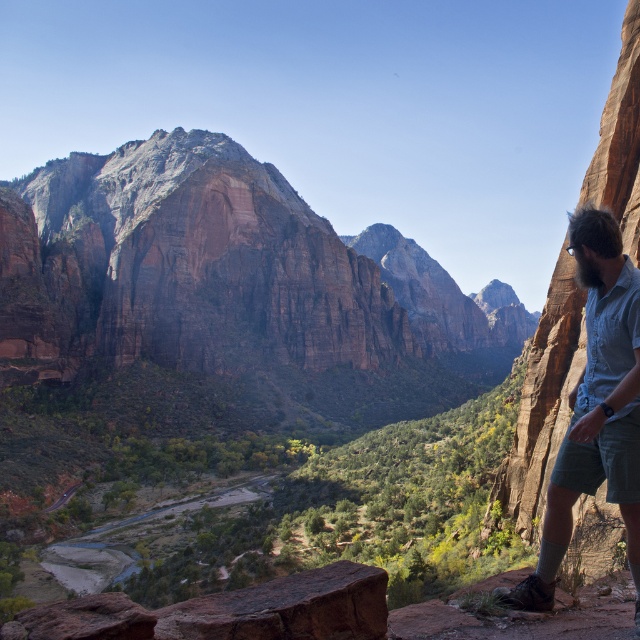
Question: Which is farther from the beige textured shirt at right?

Choices:
 (A) brown rough rock at lower center
 (B) rustic stone mountain at center

Answer: (B)

Question: Observing the image, what is the correct spatial positioning of rustic stone mountain at center in reference to beige textured shirt at right?

Choices:
 (A) below
 (B) above

Answer: (B)

Question: Where is beige textured shirt at right located in relation to brown rough rock at lower center in the image?

Choices:
 (A) above
 (B) below

Answer: (A)

Question: Can you confirm if rustic stone mountain at center is positioned to the right of brown rough rock at lower center?

Choices:
 (A) no
 (B) yes

Answer: (B)

Question: Which point is closer to the camera?

Choices:
 (A) beige textured shirt at right
 (B) rustic stone mountain at center
 (C) brown rough rock at lower center

Answer: (C)

Question: Among these points, which one is nearest to the camera?

Choices:
 (A) coord(608,212)
 (B) coord(328,628)
 (C) coord(132,196)

Answer: (B)